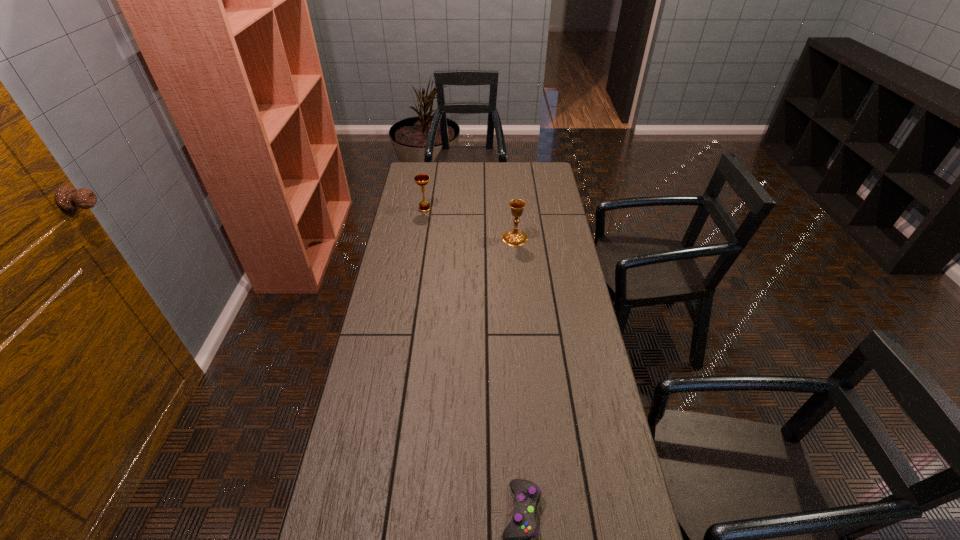
Identify the location of the nearer chalice. (515, 238).

I want to click on the right chalice, so click(x=515, y=238).

At what (x,y) coordinates should I click in order to perform the action: click on the leftmost object. Please return your answer as a coordinate pair (x, y). This screenshot has width=960, height=540. Looking at the image, I should click on (421, 179).

At what (x,y) coordinates should I click in order to perform the action: click on the farthest object. Please return your answer as a coordinate pair (x, y). Image resolution: width=960 pixels, height=540 pixels. Looking at the image, I should click on (421, 179).

This screenshot has width=960, height=540. Find the location of `blank space located on the right of the second nearest object`. blank space located on the right of the second nearest object is located at coordinates (564, 239).

At what (x,y) coordinates should I click in order to perform the action: click on free space located 0.050m on the back of the leftmost object. Please return your answer as a coordinate pair (x, y). The height and width of the screenshot is (540, 960). Looking at the image, I should click on (426, 199).

This screenshot has height=540, width=960. I want to click on object that is at the left edge, so click(421, 179).

The image size is (960, 540). What are the coordinates of `free space at the far edge of the desktop` in the screenshot? It's located at (509, 184).

Locate an element on the screen. This screenshot has height=540, width=960. vacant space at the left edge is located at coordinates (396, 234).

The image size is (960, 540). I want to click on vacant space at the right edge, so pyautogui.click(x=568, y=507).